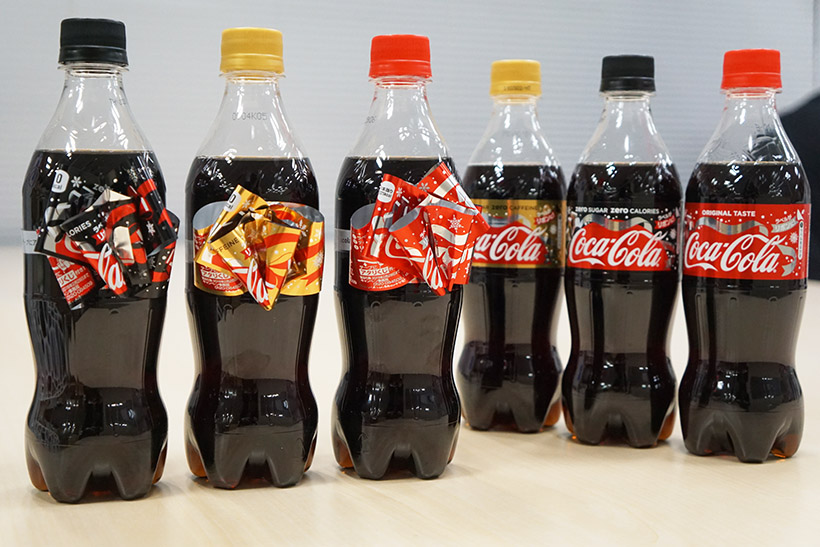
Find the location of `bottles of coca-cola`. bottles of coca-cola is located at coordinates (96, 157), (256, 159), (380, 162), (504, 174), (626, 181), (730, 177).